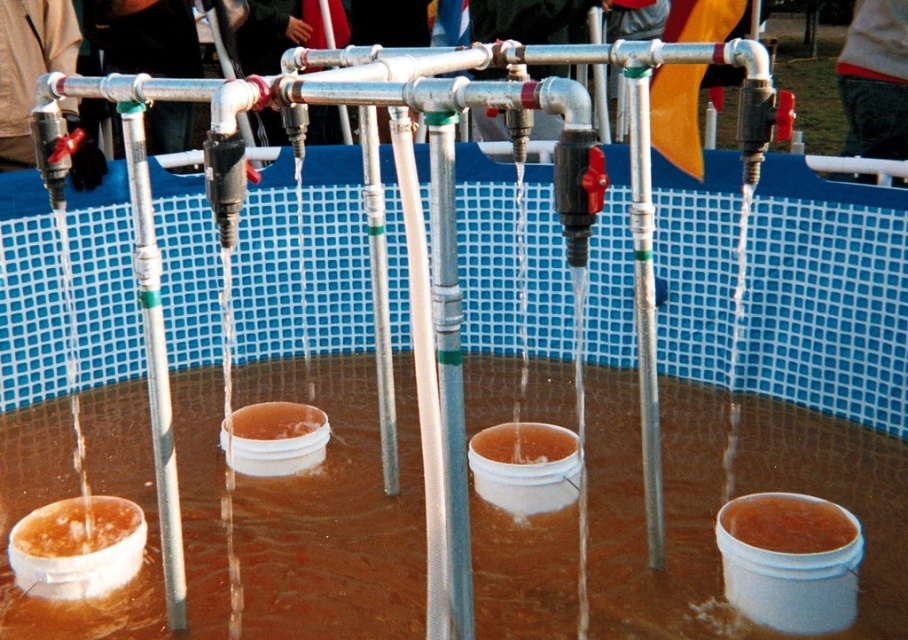
Question: Is translucent amber liquid at lower left above translucent orange liquid at center?

Choices:
 (A) no
 (B) yes

Answer: (A)

Question: Which object is closer to the camera taking this photo?

Choices:
 (A) translucent amber liquid at lower left
 (B) brown matte bucket at lower right
 (C) translucent orange liquid at center

Answer: (B)

Question: Which object is the closest to the translucent amber liquid at lower left?

Choices:
 (A) brown matte bucket at center
 (B) translucent orange liquid at center
 (C) brown matte bucket at lower right

Answer: (A)

Question: Observing the image, what is the correct spatial positioning of translucent amber liquid at lower left in reference to translucent orange liquid at center?

Choices:
 (A) left
 (B) right

Answer: (A)

Question: Considering the real-world distances, which object is closest to the translucent amber liquid at lower left?

Choices:
 (A) brown matte bucket at lower right
 (B) translucent orange liquid at center

Answer: (B)

Question: Is brown matte bucket at lower right closer to camera compared to brown matte bucket at center?

Choices:
 (A) no
 (B) yes

Answer: (B)